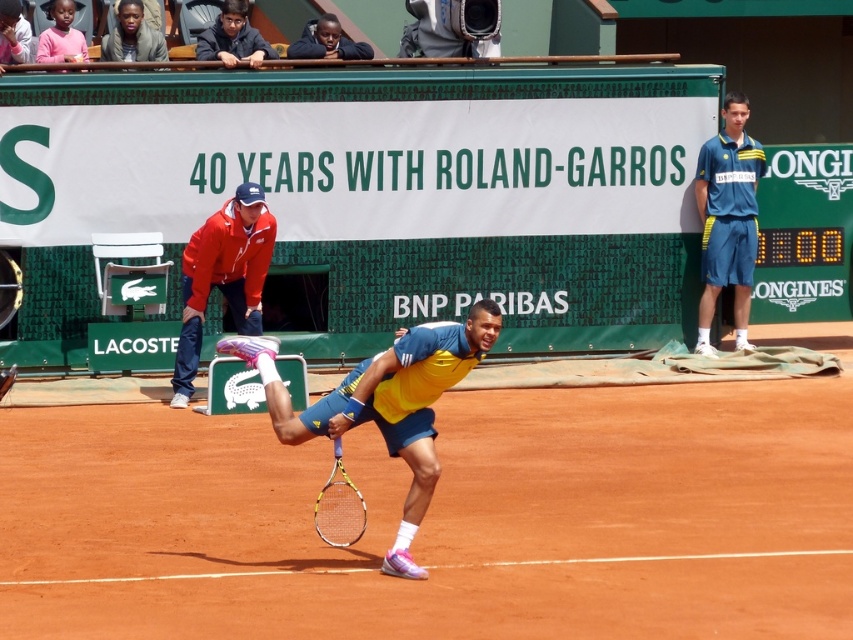
Consider the image. You are a photographer positioned at the baseline of the tennis court. You want to capture a photo that includes both the yellow fabric tennis player at center and the matte red jacket at upper left. Based on their sizes in the image, which object should you adjust your camera angle to focus on first to ensure both are in frame?

The yellow fabric tennis player at center might be wider than matte red jacket at upper left, so you should focus on the yellow fabric tennis player at center first to ensure both are in frame.

You are a photographer at the tennis match and want to capture a photo where both the blue fabric shorts at right and the dark blue jacket at upper center are visible. Considering their sizes in the image, which object should you focus on to ensure both are in frame?

The blue fabric shorts at right is taller than the dark blue jacket at upper center, so you should focus on the blue fabric shorts at right since it is larger and will help frame both objects effectively.

You are a tennis fan watching the match from the stands. You want to take a photo of the tennis player executing his forehand shot. The camera you are using has a minimum focus distance of 25 meters. Will the point at the player where the camera is aimed at the point with coordinates (x=729, y=92) be in focus?

The point at the player with coordinates (x=729, y=92) is 24.14 meters from the camera, which is less than the minimum focus distance of 25 meters. Therefore, the camera will not be able to focus on that point.